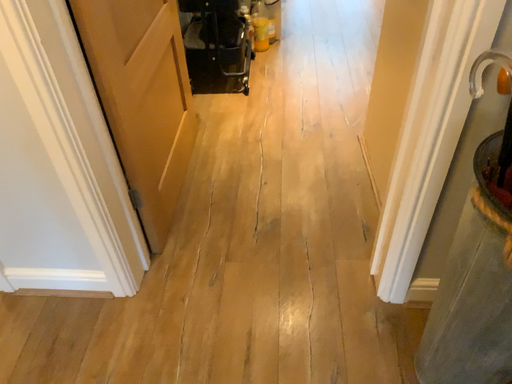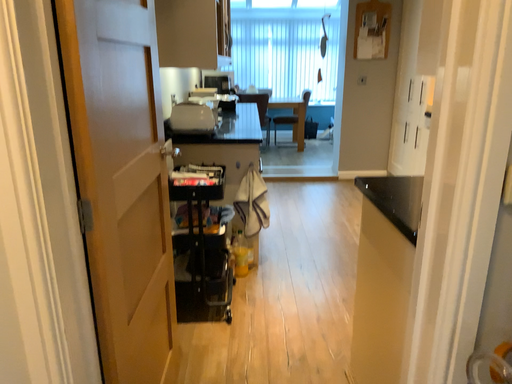
Question: Which way did the camera rotate in the video?

Choices:
 (A) rotated upward
 (B) rotated downward

Answer: (A)